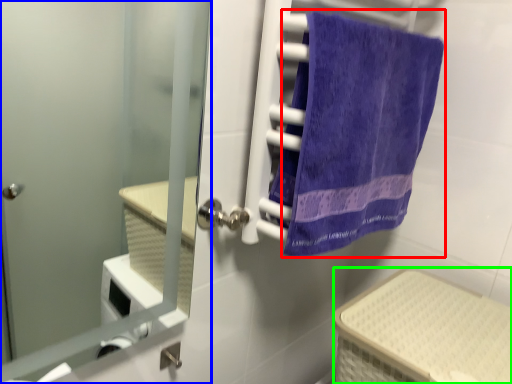
Question: Based on their relative distances, which object is nearer to towel (highlighted by a red box)? Choose from door (highlighted by a blue box) and basket (highlighted by a green box).

Choices:
 (A) door
 (B) basket

Answer: (B)